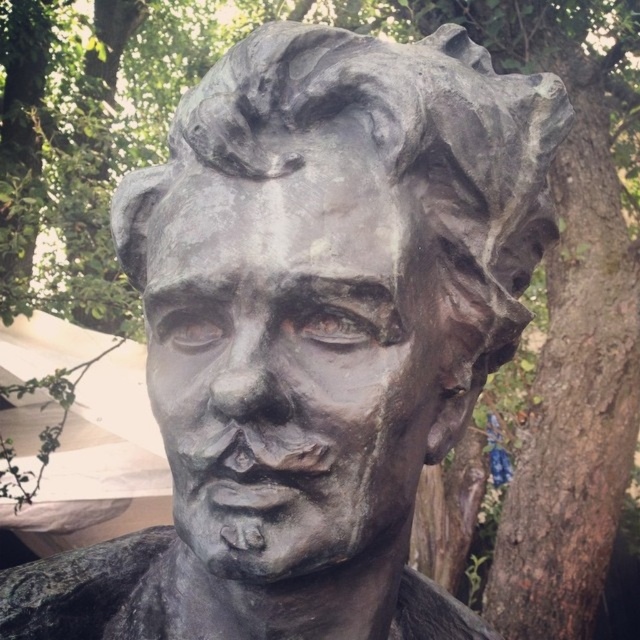
You are standing in a garden surrounded by greenery and notice a bronze statue at center. If you want to take a photo of the statue with the lush green foliage in the background, which direction should you face relative to the statue?

The bronze statue at center is located at point (332, 276), so you should position yourself facing the statue with the background of lush green foliage behind it to capture both in the photo.

You are an art conservator assessing the bronze statue at center and bronze sculpture at center in the image. Which object has a greater width according to the description?

The bronze statue at center has a greater width than the bronze sculpture at center.